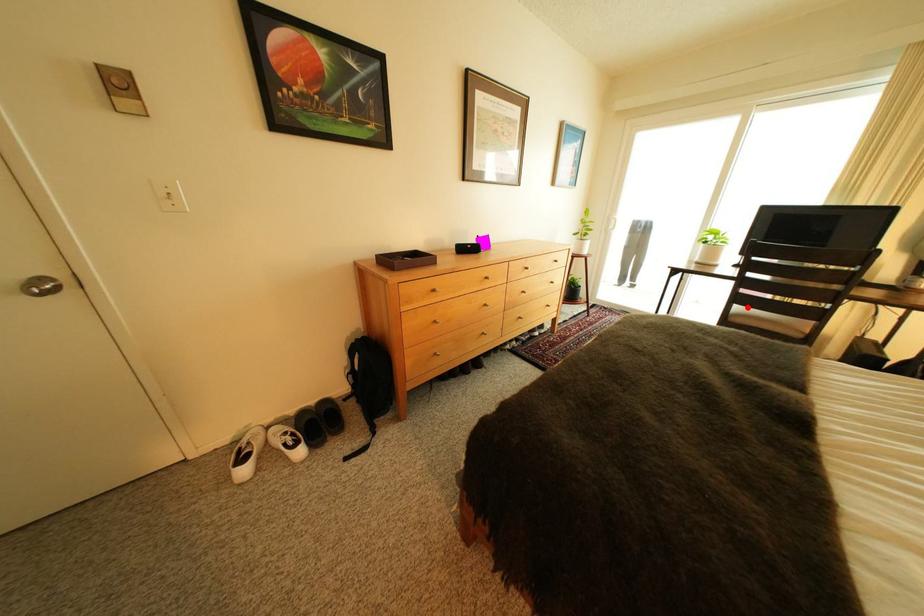
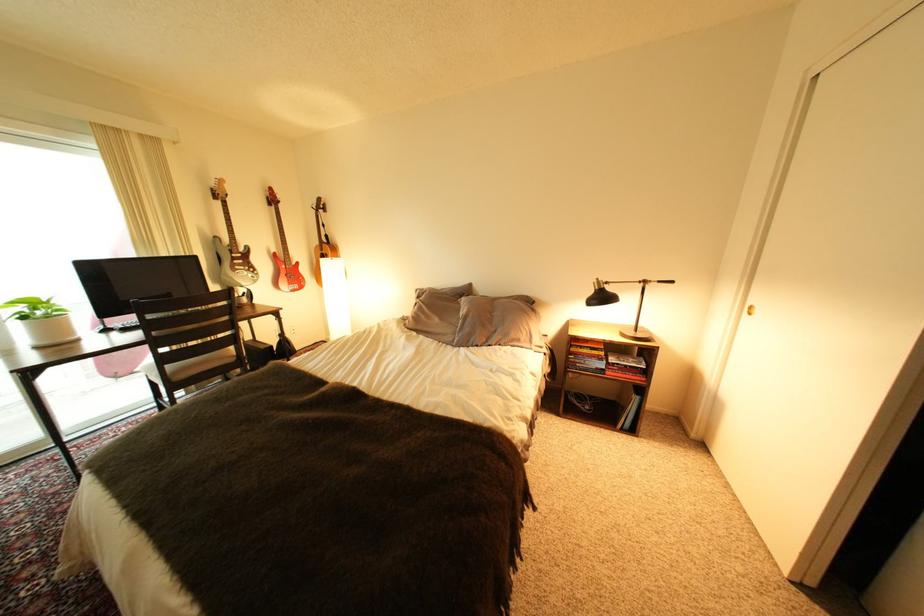
Locate, in the second image, the point that corresponds to the highlighted location in the first image.

(178, 368)